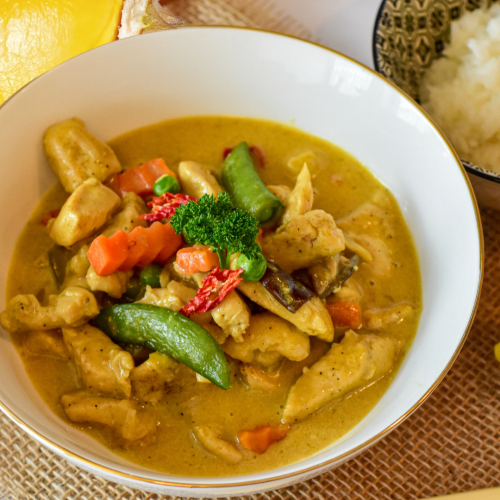
Find the location of a particular element. The height and width of the screenshot is (500, 500). gray and navy blue bowl is located at coordinates (403, 29).